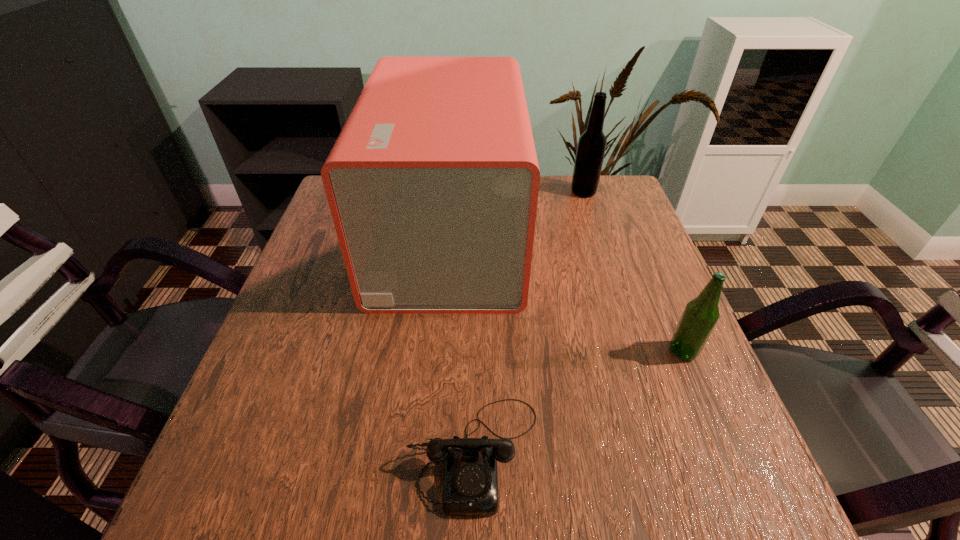
In the image, there is a desktop. Identify the location of vacant space at the left edge. (279, 405).

In the image, there is a desktop. At what (x,y) coordinates should I click in order to perform the action: click on vacant space at the right edge. Please return your answer as a coordinate pair (x, y). This screenshot has width=960, height=540. Looking at the image, I should click on (593, 266).

Where is `vacant region at the near left corner`? vacant region at the near left corner is located at coordinates (219, 488).

Where is `free point at the far right corner`? free point at the far right corner is located at coordinates (622, 193).

At what (x,y) coordinates should I click in order to perform the action: click on empty location between the second object from right to left and the third farthest object. Please return your answer as a coordinate pair (x, y). Looking at the image, I should click on (634, 272).

Locate an element on the screen. The image size is (960, 540). vacant area that lies between the farther beer bottle and the rightmost object is located at coordinates (634, 272).

The width and height of the screenshot is (960, 540). I want to click on vacant area that lies between the taller beer bottle and the telephone, so click(x=529, y=322).

This screenshot has height=540, width=960. In order to click on vacant area between the second tallest object and the nearer beer bottle in this screenshot , I will do `click(634, 272)`.

Identify the location of vacant point located between the right beer bottle and the third object from left to right. (634, 272).

At what (x,y) coordinates should I click in order to perform the action: click on free space between the second shortest object and the box. Please return your answer as a coordinate pair (x, y). Image resolution: width=960 pixels, height=540 pixels. Looking at the image, I should click on (566, 294).